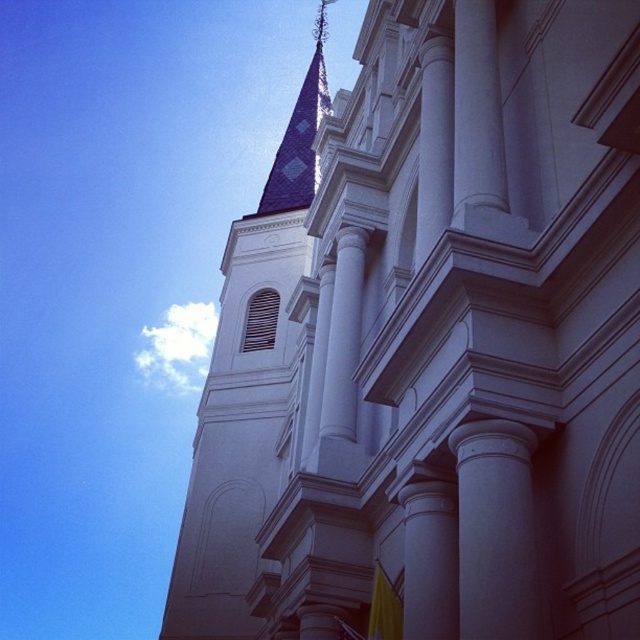
You are an architect assessing the proportions of the building. Which object, the white stone steeple at upper center or the smooth white column at center, has a greater height when viewed from the ground?

The white stone steeple at upper center has a larger size compared to the smooth white column at center, so it is taller and would appear taller when viewed from the ground.

You are an architect examining the building. You notice the white stone steeple at upper center and the smooth white column at center. Which of these two objects is positioned to the left of the other?

The white stone steeple at upper center is to the left of the smooth white column at center.

You are standing in front of the grand classical building and want to take a photo of the smooth white column at center without the white stone steeple at upper center blocking it. How should you adjust your position?

Move to the side so that the smooth white column at center is no longer aligned with the white stone steeple at upper center. Since the smooth white column at center is behind the steeple, shifting your angle would allow you to capture the column without the steeple obstructing it.